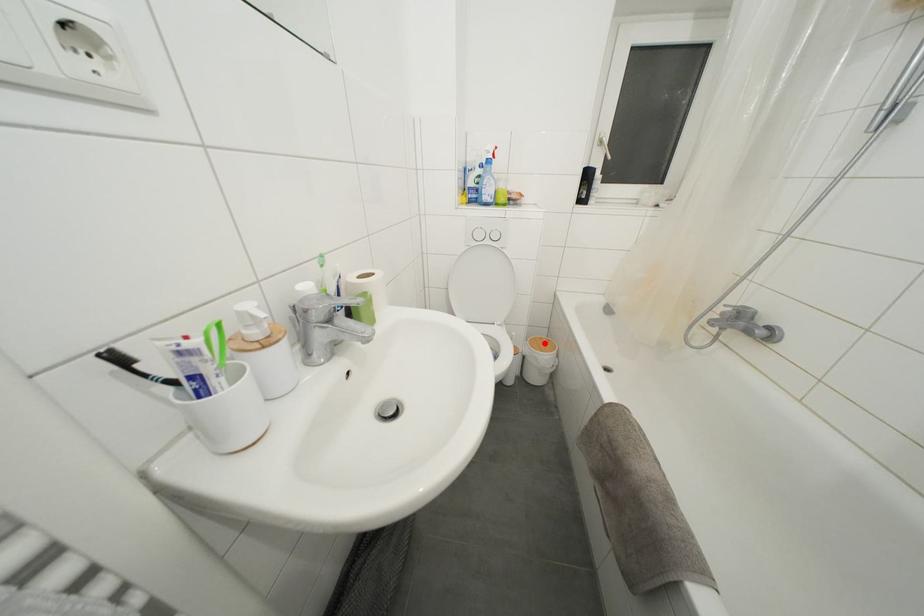
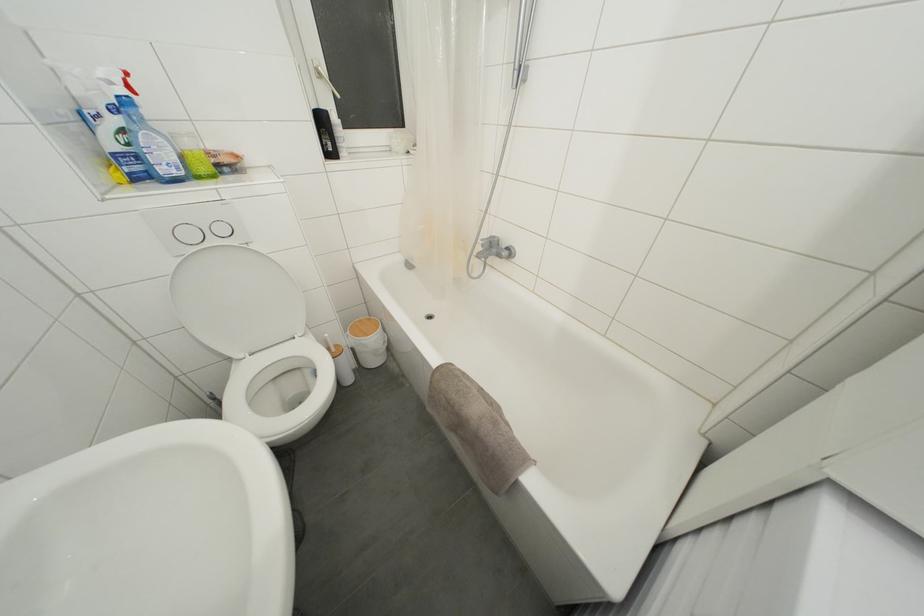
In the second image, find the point that corresponds to the highlighted location in the first image.

(363, 326)